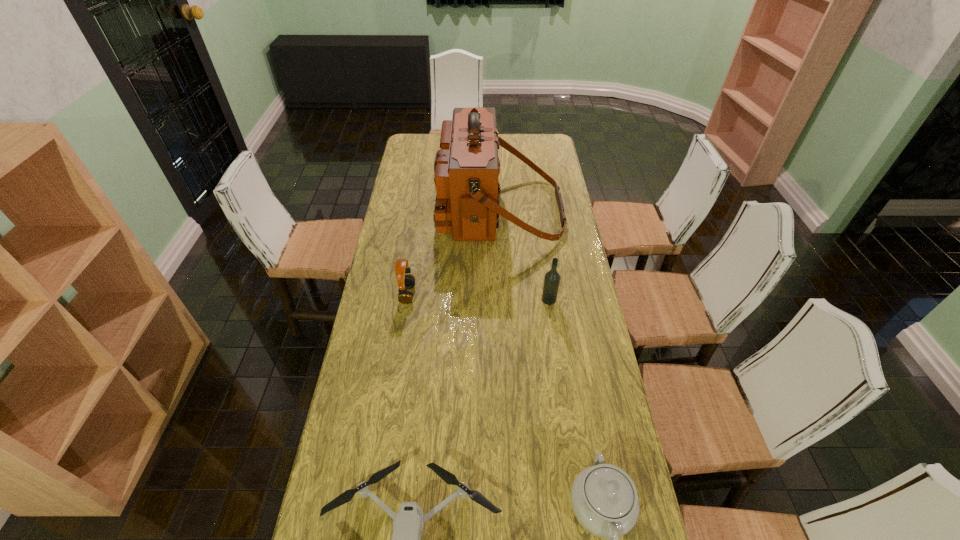
Locate an element on the screen. This screenshot has height=540, width=960. free space at the left edge of the desktop is located at coordinates (364, 360).

This screenshot has height=540, width=960. Find the location of `free spot at the right edge of the desktop`. free spot at the right edge of the desktop is located at coordinates (x=581, y=382).

I want to click on blank region between the satchel and the vodka, so click(x=524, y=255).

This screenshot has height=540, width=960. I want to click on free spot between the headset and the satchel, so click(x=454, y=252).

Find the location of a particular element. free space between the headset and the vodka is located at coordinates (478, 297).

You are a GUI agent. You are given a task and a screenshot of the screen. Output one action in this format:
    pyautogui.click(x=<x>, y=<y>)
    Task: Click on the object that is the third closest one to the farthest object
    Image resolution: width=960 pixels, height=540 pixels.
    Given the screenshot: What is the action you would take?
    pyautogui.click(x=604, y=499)

Find the location of a particular element. object that stands as the closest to the satchel is located at coordinates (x=404, y=281).

Find the location of a particular element. vacant region that satisfies the following two spatial constraints: 1. on the face side of the farthest object; 2. on the back side of the second tallest object is located at coordinates (504, 299).